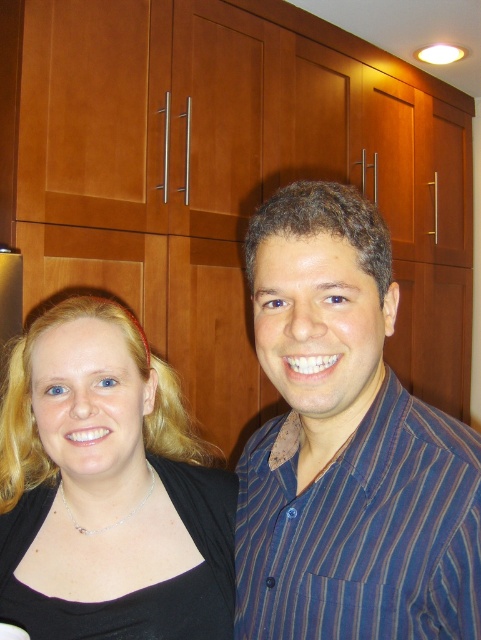
Does matte black shirt at center have a lesser width compared to black fabric at center?

Yes, matte black shirt at center is thinner than black fabric at center.

What do you see at coordinates (346, 445) in the screenshot? I see `matte black shirt at center` at bounding box center [346, 445].

You are a GUI agent. You are given a task and a screenshot of the screen. Output one action in this format:
    pyautogui.click(x=<x>, y=<y>)
    Task: Click on the matte black shirt at center
    
    Given the screenshot: What is the action you would take?
    pyautogui.click(x=346, y=445)

From the picture: Is black fabric at center shorter than blue striped shirt at center?

No.

Locate an element on the screen. The width and height of the screenshot is (481, 640). black fabric at center is located at coordinates (109, 488).

Is point (3, 602) positioned before point (372, 573)?

No, (3, 602) is behind (372, 573).

Where is `black fabric at center`? Image resolution: width=481 pixels, height=640 pixels. black fabric at center is located at coordinates (109, 488).

Where is `matte black shirt at center`? The height and width of the screenshot is (640, 481). matte black shirt at center is located at coordinates (346, 445).

Between point (402, 408) and point (443, 584), which one is positioned behind?

Point (402, 408)

At what (x,y) coordinates should I click in order to perform the action: click on matte black shirt at center. Please return your answer as a coordinate pair (x, y). This screenshot has width=481, height=640. Looking at the image, I should click on (346, 445).